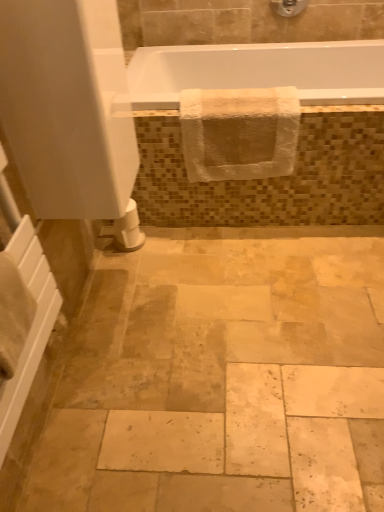
I want to click on free space in front of white matte toilet paper at lower left, so click(138, 264).